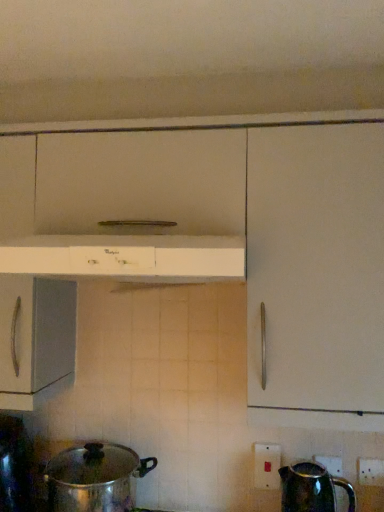
Question: Is shiny metallic kettle at lower right taller or shorter than shiny metallic pot at lower left?

Choices:
 (A) short
 (B) tall

Answer: (A)

Question: From a real-world perspective, is shiny metallic kettle at lower right physically located above or below shiny metallic pot at lower left?

Choices:
 (A) below
 (B) above

Answer: (A)

Question: Which of these objects is positioned farthest from the white plastic electric outlet at lower right, the 2th electric outlet when ordered from front to back?

Choices:
 (A) shiny metallic pot at lower left
 (B) shiny metallic kettle at lower right
 (C) shiny metallic pot at lower left
 (D) white plastic electric outlet at lower right, which appears as the second electric outlet when viewed from the left
 (E) white glossy range hood at center

Answer: (E)

Question: Which object is the closest to the white plastic electric outlet at lower right, which is counted as the 1th electric outlet, starting from the front?

Choices:
 (A) shiny metallic pot at lower left
 (B) shiny metallic pot at lower left
 (C) shiny metallic kettle at lower right
 (D) white plastic electric outlet at lower right, arranged as the 1th electric outlet when viewed from the left
 (E) white glossy range hood at center

Answer: (C)